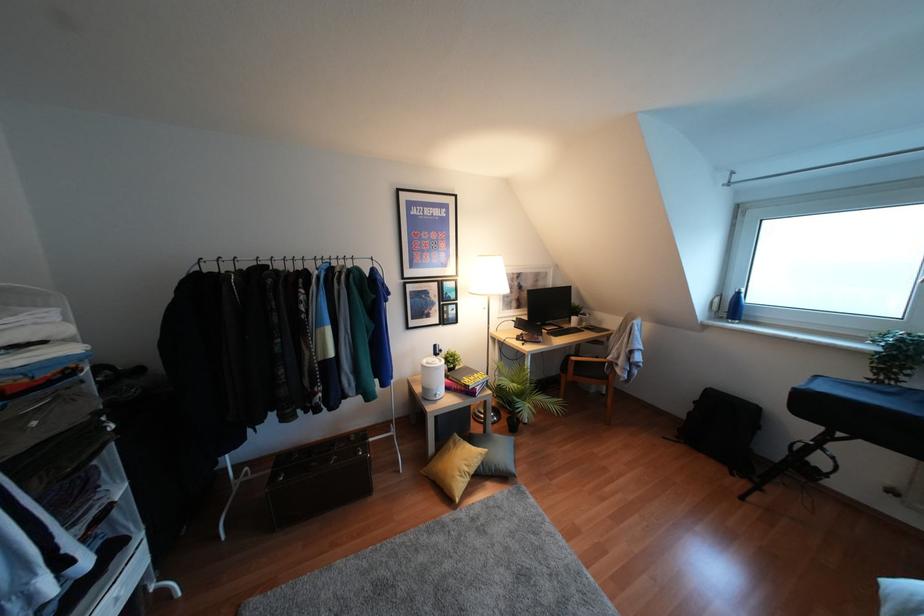
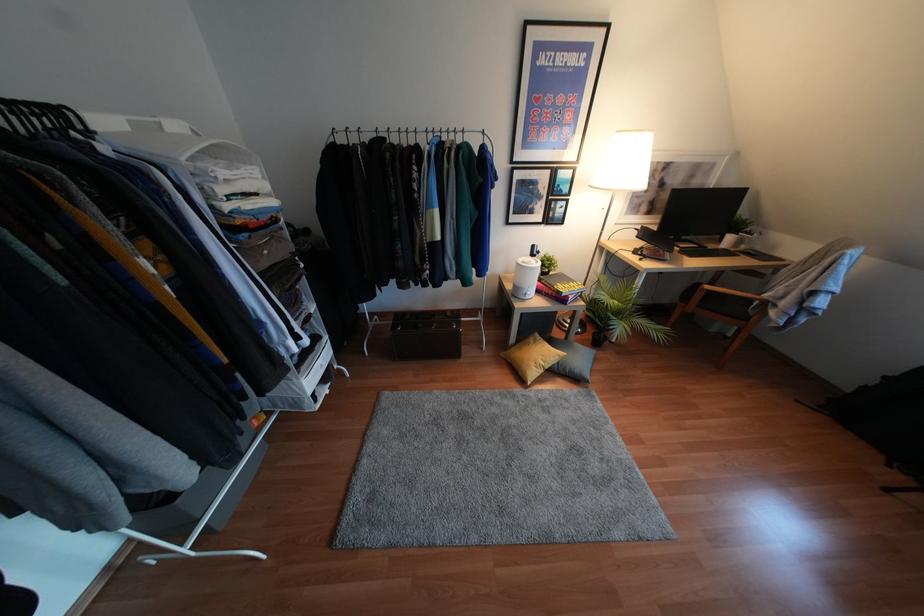
First-person continuous shooting, in which direction is the camera rotating?

The camera's rotation is toward left-down.